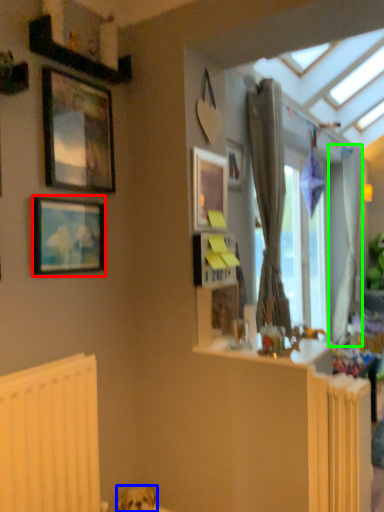
Question: Which object is the farthest from picture frame (highlighted by a red box)? Choose among these: dog (highlighted by a blue box) or curtain (highlighted by a green box).

Choices:
 (A) dog
 (B) curtain

Answer: (B)